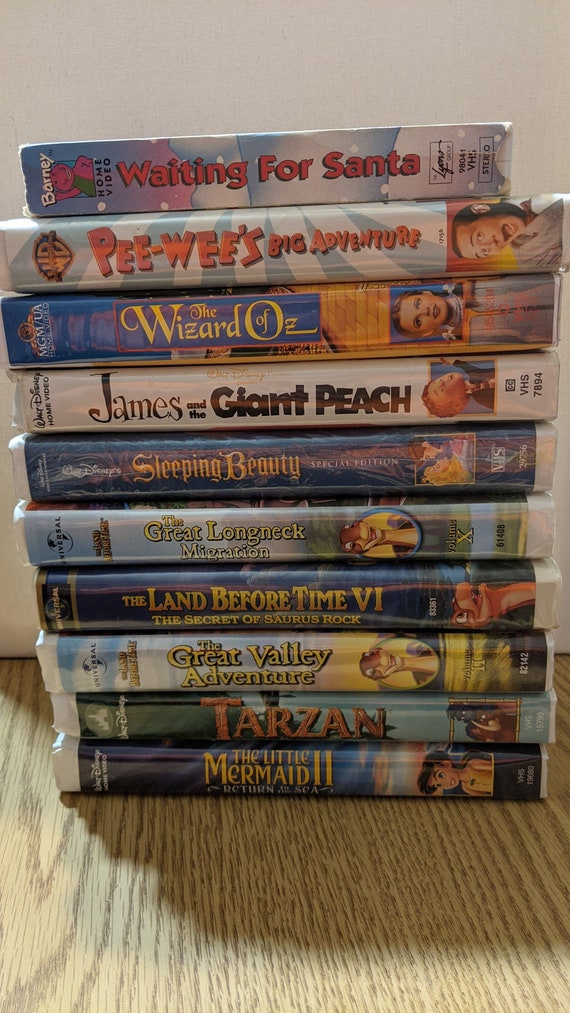
Where is `vhs cases`? The image size is (570, 1013). vhs cases is located at coordinates (195, 716), (173, 775), (310, 656), (293, 617), (227, 556), (253, 482), (181, 409), (390, 307), (339, 247), (329, 172).